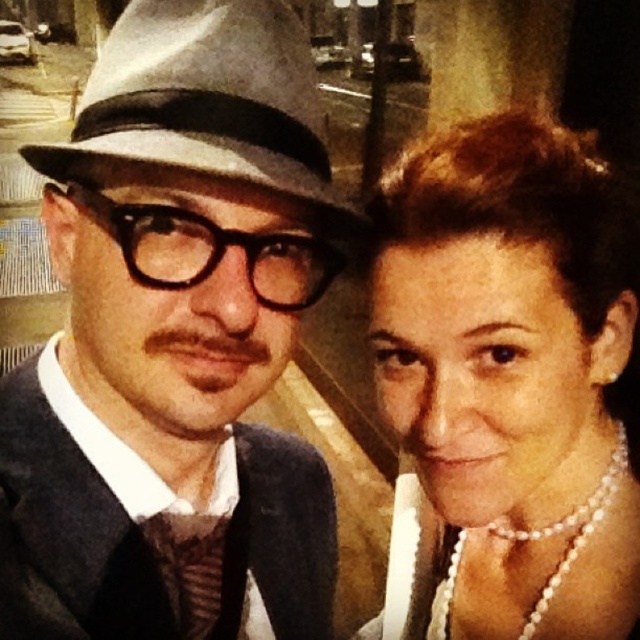
Does dark blue woolen suit at center have a lesser width compared to gray felt fedora at left?

Yes, dark blue woolen suit at center is thinner than gray felt fedora at left.

Which of these two, dark blue woolen suit at center or gray felt fedora at left, stands shorter?

Standing shorter between the two is gray felt fedora at left.

This screenshot has height=640, width=640. I want to click on dark blue woolen suit at center, so click(x=72, y=524).

Identify the location of dark blue woolen suit at center. (72, 524).

Is matte gray hat at left further to the viewer compared to pearl necklace at upper right?

No.

Can you confirm if matte gray hat at left is positioned to the right of pearl necklace at upper right?

No, matte gray hat at left is not to the right of pearl necklace at upper right.

Based on the photo, measure the distance between matte gray hat at left and camera.

matte gray hat at left and camera are 18.01 inches apart from each other.

At what (x,y) coordinates should I click in order to perform the action: click on matte gray hat at left. Please return your answer as a coordinate pair (x, y). Image resolution: width=640 pixels, height=640 pixels. Looking at the image, I should click on (176, 340).

Is matte gray hat at left closer to camera compared to striped fabric tie at center?

→ That is True.

Which is behind, point (26, 627) or point (179, 586)?

The point (179, 586) is more distant.

Between point (205, 272) and point (182, 554), which one is positioned behind?

The point (182, 554) is more distant.

You are a GUI agent. You are given a task and a screenshot of the screen. Output one action in this format:
    pyautogui.click(x=<x>, y=<y>)
    Task: Click on the matte gray hat at left
    
    Given the screenshot: What is the action you would take?
    pyautogui.click(x=176, y=340)